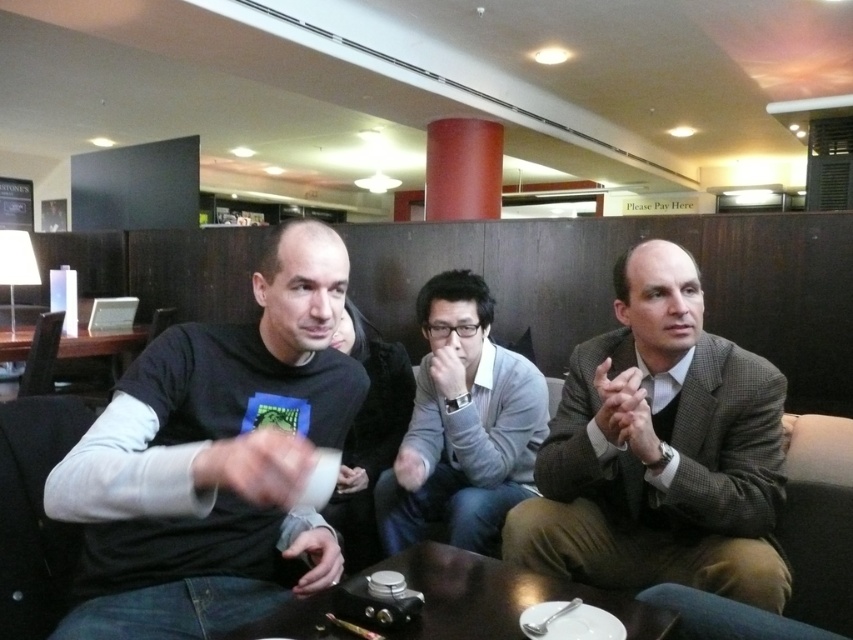
Question: Does black matte shirt at center appear on the left side of shiny dark wood table at center?

Choices:
 (A) no
 (B) yes

Answer: (B)

Question: Observing the image, what is the correct spatial positioning of gray wool suit at center in reference to gray matte sweater at center?

Choices:
 (A) below
 (B) above

Answer: (B)

Question: Can you confirm if gray matte sweater at center is bigger than shiny dark wood table at center?

Choices:
 (A) yes
 (B) no

Answer: (A)

Question: Which object appears farthest from the camera in this image?

Choices:
 (A) shiny dark wood table at center
 (B) black matte shirt at center
 (C) gray wool suit at center

Answer: (C)

Question: Which of the following is the farthest from the observer?

Choices:
 (A) shiny dark wood table at center
 (B) gray matte sweater at center

Answer: (B)

Question: Which point is closer to the camera taking this photo?

Choices:
 (A) (445, 340)
 (B) (431, 586)
 (C) (755, 545)

Answer: (B)